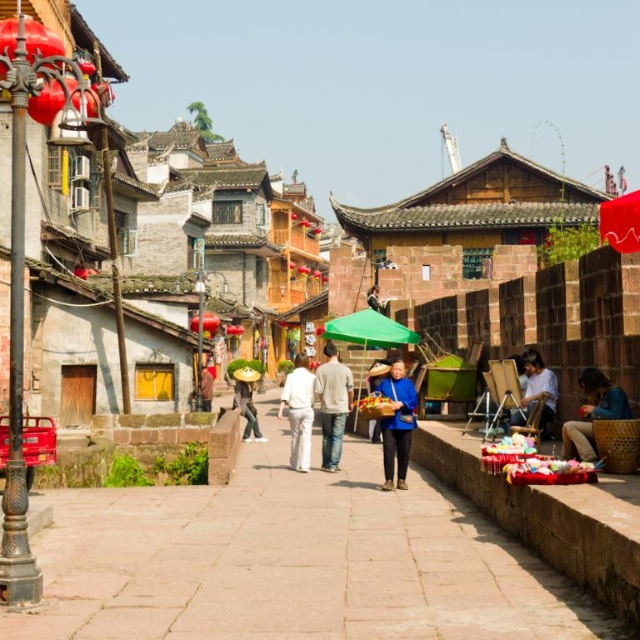
Between white cotton pants at center and green straw hat at center, which one has more height?

With more height is white cotton pants at center.

Is white cotton pants at center thinner than green straw hat at center?

Correct, white cotton pants at center's width is less than green straw hat at center's.

Is point (282, 396) farther from camera compared to point (253, 435)?

No, it is not.

You are a GUI agent. You are given a task and a screenshot of the screen. Output one action in this format:
    pyautogui.click(x=<x>, y=<y>)
    Task: Click on the white cotton pants at center
    
    Given the screenshot: What is the action you would take?
    pyautogui.click(x=298, y=412)

Does green fabric umbrella at center appear over green straw hat at center?

Indeed, green fabric umbrella at center is positioned over green straw hat at center.

Who is shorter, green fabric umbrella at center or green straw hat at center?

With less height is green fabric umbrella at center.

Does point (387, 342) lie in front of point (250, 397)?

No.

In order to click on green fabric umbrella at center in this screenshot , I will do `click(369, 330)`.

Which is above, blue fabric basket at center or brown leather jacket at center?

brown leather jacket at center is above.

The width and height of the screenshot is (640, 640). What do you see at coordinates (396, 422) in the screenshot?
I see `blue fabric basket at center` at bounding box center [396, 422].

Where is `blue fabric basket at center`? blue fabric basket at center is located at coordinates (396, 422).